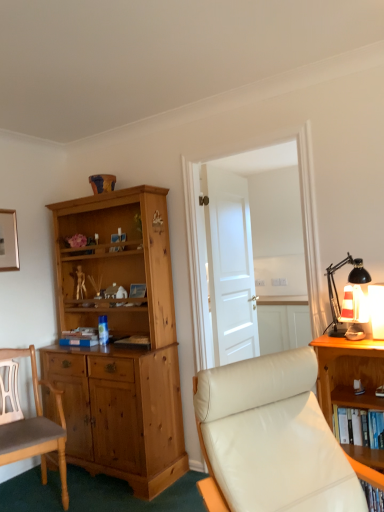
Question: From the image's perspective, is light brown wood chair at left, acting as the second chair starting from the front, located above wooden bookshelf at right?

Choices:
 (A) no
 (B) yes

Answer: (A)

Question: Considering the relative positions of light brown wood chair at left, the first chair positioned from the back, and wooden bookshelf at right in the image provided, is light brown wood chair at left, the first chair positioned from the back, to the right of wooden bookshelf at right from the viewer's perspective?

Choices:
 (A) yes
 (B) no

Answer: (B)

Question: Is light brown wood chair at left, the first chair positioned from the back, thinner than wooden bookshelf at right?

Choices:
 (A) yes
 (B) no

Answer: (B)

Question: From the image's perspective, is light brown wood chair at left, acting as the second chair starting from the front, under wooden bookshelf at right?

Choices:
 (A) yes
 (B) no

Answer: (A)

Question: Would you consider light brown wood chair at left, acting as the second chair starting from the front, to be distant from wooden bookshelf at right?

Choices:
 (A) no
 (B) yes

Answer: (B)

Question: Is light brown wood chair at left, the first chair positioned from the back, not inside wooden bookshelf at right?

Choices:
 (A) yes
 (B) no

Answer: (A)

Question: Does white leather chair at center, the 1th chair viewed from the right, contain light brown wood chair at left, acting as the second chair starting from the front?

Choices:
 (A) no
 (B) yes

Answer: (A)

Question: Is white leather chair at center, the 1th chair viewed from the right, not close to light brown wood chair at left, which appears as the 1th chair when viewed from the left?

Choices:
 (A) yes
 (B) no

Answer: (A)

Question: Can you confirm if white leather chair at center, the 1th chair in the front-to-back sequence, is thinner than light brown wood chair at left, acting as the second chair starting from the front?

Choices:
 (A) yes
 (B) no

Answer: (B)

Question: Could you tell me if white leather chair at center, the second chair from the left, is facing light brown wood chair at left, acting as the second chair starting from the front?

Choices:
 (A) yes
 (B) no

Answer: (B)

Question: Is white leather chair at center, the second chair in the back-to-front sequence, closer to the viewer compared to light brown wood chair at left, acting as the second chair starting from the right?

Choices:
 (A) no
 (B) yes

Answer: (B)

Question: From the image's perspective, is white leather chair at center, the second chair from the left, over light brown wood chair at left, the first chair positioned from the back?

Choices:
 (A) yes
 (B) no

Answer: (A)

Question: Is white glossy door at center facing away from white matte door at center?

Choices:
 (A) yes
 (B) no

Answer: (A)